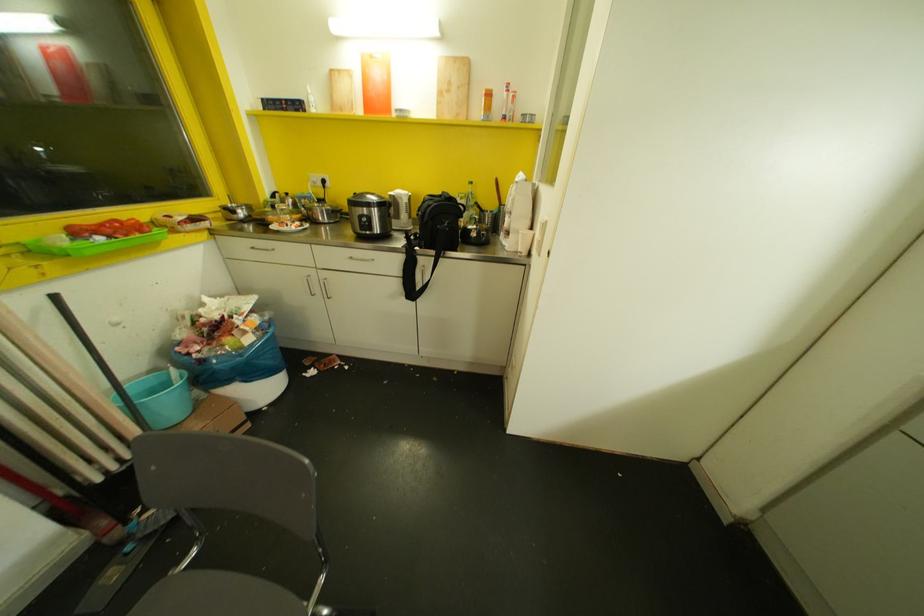
Where would you lift the green plastic tray? Please return your answer as a coordinate pair (x, y).

(103, 236)